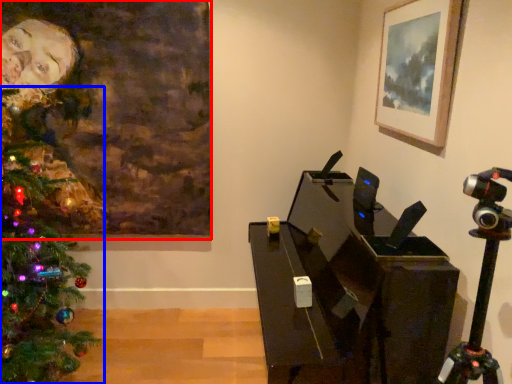
Question: Among these objects, which one is nearest to the camera, picture frame (highlighted by a red box) or christmas tree (highlighted by a blue box)?

Choices:
 (A) picture frame
 (B) christmas tree

Answer: (B)